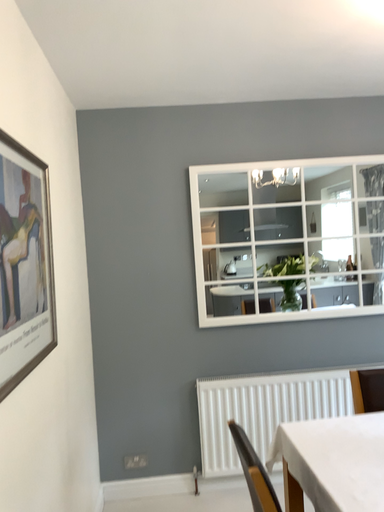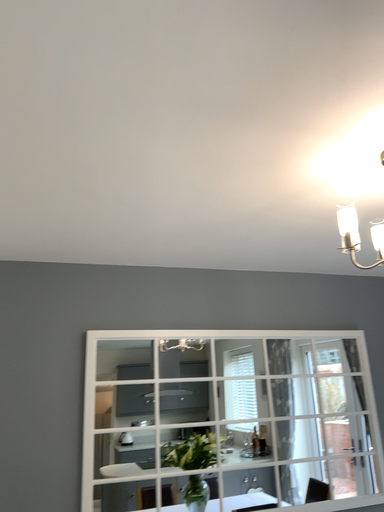
Question: Which way did the camera rotate in the video?

Choices:
 (A) rotated downward
 (B) rotated upward

Answer: (B)